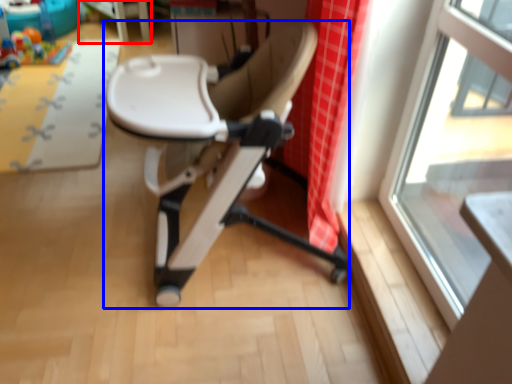
Question: Which object appears closest to the camera in this image, table (highlighted by a red box) or chair (highlighted by a blue box)?

Choices:
 (A) table
 (B) chair

Answer: (B)